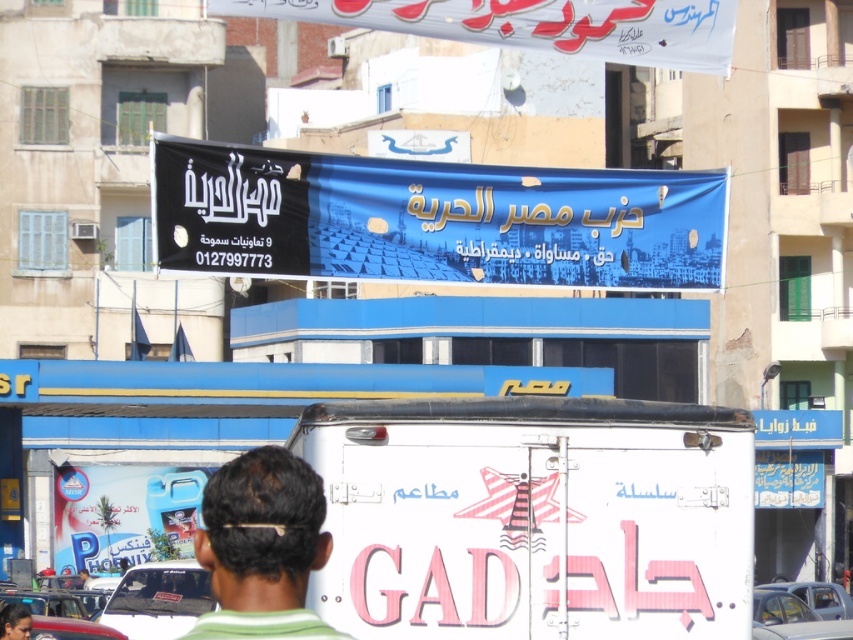
You are standing in the urban scene described. There are two points marked as point (292, 515) and point (9, 625). Which point is closer to you?

Point (292, 515) is in front of point (9, 625), so it is closer to you.

You are a delivery person who needs to park your 1.5 meter wide motorcycle between the white glossy food truck at center and the dark brown hair at center. Can you fit your motorcycle between them?

The white glossy food truck at center is thinner than the dark brown hair at center. The space between them is determined by the width of the wider object, which is the dark brown hair at center. Since the motorcycle is 1.5 meters wide, it can fit as long as the space between them is at least 1.5 meters. However, without specific distance information, we cannot confirm the exact width of the gap. Please check the actual space before parking.